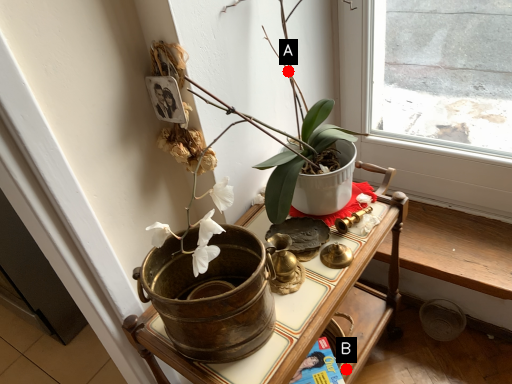
Question: Two points are circled on the image, labeled by A and B beside each circle. Which point is farther to the camera?

Choices:
 (A) A is further
 (B) B is further

Answer: (B)